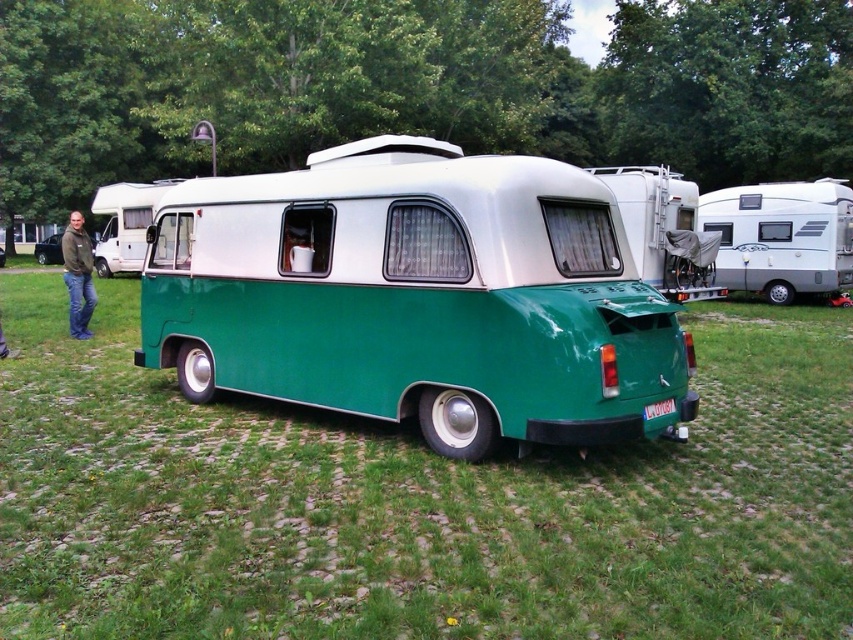
Can you confirm if green glossy recreational vehicle at center is taller than white plastic camper van at left?

No.

Which is more to the right, green glossy recreational vehicle at center or white plastic camper van at left?

green glossy recreational vehicle at center is more to the right.

The height and width of the screenshot is (640, 853). What do you see at coordinates (416, 298) in the screenshot?
I see `green glossy recreational vehicle at center` at bounding box center [416, 298].

Where is `green glossy recreational vehicle at center`? green glossy recreational vehicle at center is located at coordinates (416, 298).

Does green matte grass at center come behind green matte van at center?

That is False.

This screenshot has width=853, height=640. What do you see at coordinates (416, 500) in the screenshot?
I see `green matte grass at center` at bounding box center [416, 500].

Identify the location of green matte grass at center. Image resolution: width=853 pixels, height=640 pixels. [x=416, y=500].

Between point (151, 192) and point (90, 276), which one is positioned in front?

Point (90, 276) is more forward.

Is white plastic camper van at left bigger than green matte jacket at left?

Incorrect, white plastic camper van at left is not larger than green matte jacket at left.

This screenshot has width=853, height=640. Identify the location of white plastic camper van at left. (125, 224).

Identify the location of white plastic camper van at left. This screenshot has width=853, height=640. (125, 224).